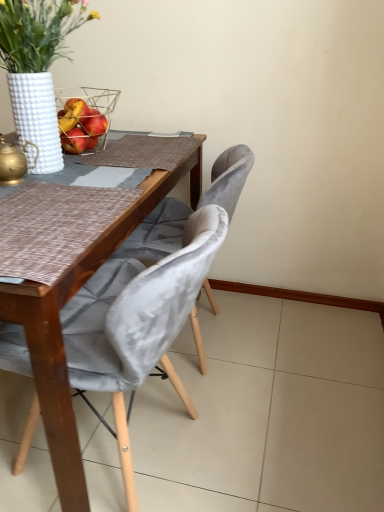
Question: Does point (71, 6) appear closer or farther from the camera than point (213, 180)?

Choices:
 (A) farther
 (B) closer

Answer: (B)

Question: From their relative heights in the image, would you say white textured vase at upper left is taller or shorter than velvet grey chair at center, the 2th chair positioned from the front?

Choices:
 (A) short
 (B) tall

Answer: (A)

Question: Estimate the real-world distances between objects in this image. Which object is closer to the velvet grey chair at center, acting as the 1th chair starting from the back?

Choices:
 (A) metallic wire picnic basket at upper left
 (B) white textured vase at upper left
 (C) gold metallic teapot at left
 (D) velvet grey chair at center, placed as the 2th chair when sorted from back to front

Answer: (D)

Question: Which is farther from the velvet grey chair at center, acting as the 1th chair starting from the back?

Choices:
 (A) gold metallic teapot at left
 (B) velvet grey chair at center, placed as the 2th chair when sorted from back to front
 (C) white textured vase at upper left
 (D) metallic wire picnic basket at upper left

Answer: (C)